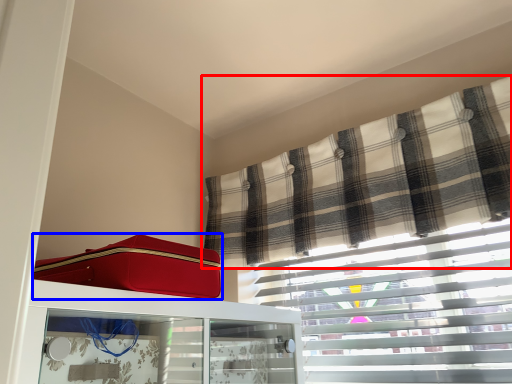
Question: Which point is closer to the camera, curtain (highlighted by a red box) or suitcase (highlighted by a blue box)?

Choices:
 (A) curtain
 (B) suitcase

Answer: (B)